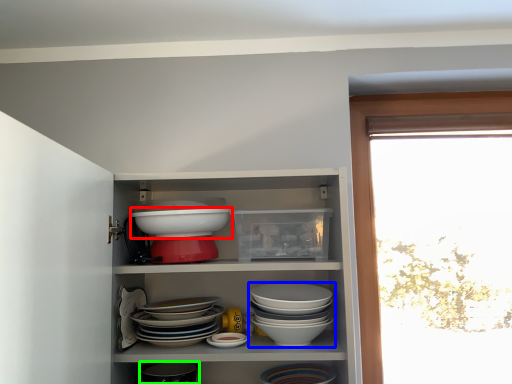
Question: Considering the real-world distances, which object is farthest from bowl (highlighted by a red box)? bowl (highlighted by a blue box) or tableware (highlighted by a green box)?

Choices:
 (A) bowl
 (B) tableware

Answer: (B)